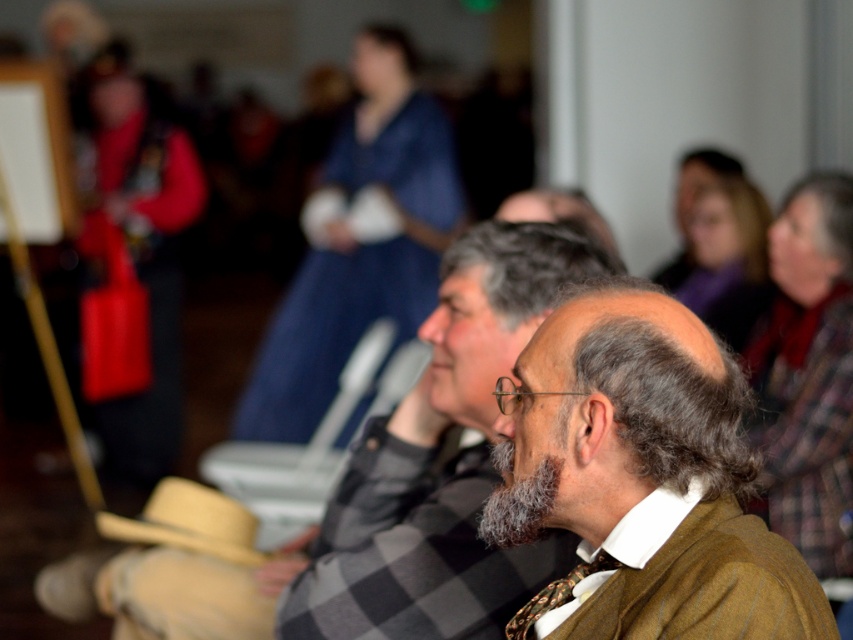
Question: Is brown woolen sweater at center further to the viewer compared to printed silk tie at center?

Choices:
 (A) no
 (B) yes

Answer: (B)

Question: Does brown woolen coat at center appear under brown wool sweater at center?

Choices:
 (A) yes
 (B) no

Answer: (A)

Question: Considering the relative positions of brown wool sweater at center and gray fuzzy beard at center in the image provided, where is brown wool sweater at center located with respect to gray fuzzy beard at center?

Choices:
 (A) left
 (B) right

Answer: (A)

Question: Which object is farther from the camera taking this photo?

Choices:
 (A) brown woolen coat at center
 (B) gray fuzzy beard at center
 (C) brown woolen sweater at center

Answer: (C)

Question: Which of the following is the farthest from the observer?

Choices:
 (A) (514, 294)
 (B) (837, 308)
 (C) (558, 310)

Answer: (B)

Question: Which is nearer to the brown wool sweater at center?

Choices:
 (A) gray fuzzy beard at center
 (B) brown woolen sweater at center

Answer: (A)